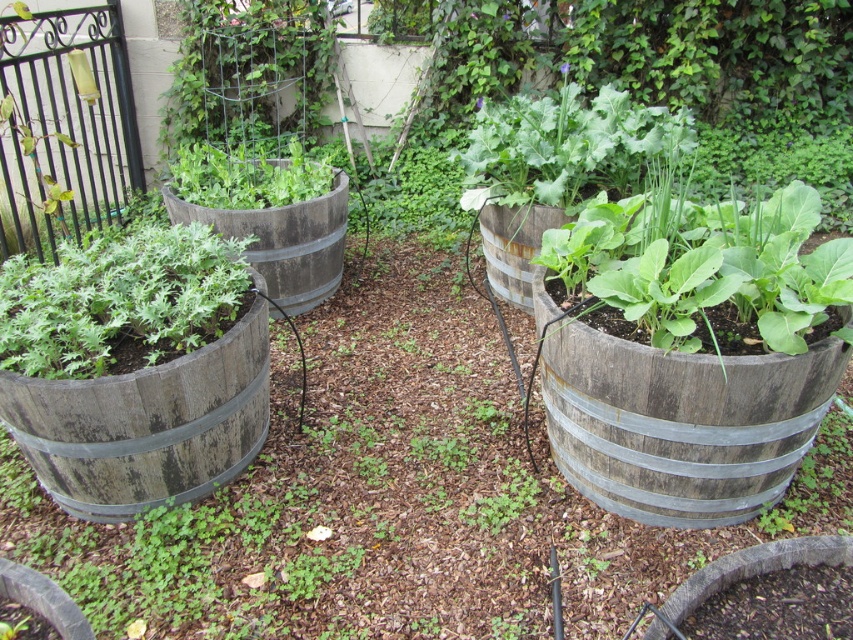
Can you confirm if gray wood barrel at center is wider than rusty wood barrel at center-right?

Yes.

Find the location of a particular element. This screenshot has width=853, height=640. gray wood barrel at center is located at coordinates (283, 241).

Locate an element on the screen. The width and height of the screenshot is (853, 640). gray wood barrel at center is located at coordinates (283, 241).

Is weathered wood barrel at center below gray wood barrel at center?

Indeed, weathered wood barrel at center is positioned under gray wood barrel at center.

Who is lower down, weathered wood barrel at center or gray wood barrel at center?

weathered wood barrel at center

This screenshot has width=853, height=640. Identify the location of weathered wood barrel at center. (682, 422).

You are a GUI agent. You are given a task and a screenshot of the screen. Output one action in this format:
    pyautogui.click(x=<x>, y=<y>)
    Task: Click on the weathered wood barrel at center
    The image size is (853, 640).
    Given the screenshot: What is the action you would take?
    pyautogui.click(x=682, y=422)

In the scene shown: Who is positioned more to the left, wooden barrel at left or green matte barrel at left?

green matte barrel at left

Can you confirm if wooden barrel at left is positioned to the left of green matte barrel at left?

Incorrect, wooden barrel at left is not on the left side of green matte barrel at left.

Which is in front, point (175, 448) or point (111, 282)?

Positioned in front is point (175, 448).

Where is `wooden barrel at left`? This screenshot has width=853, height=640. wooden barrel at left is located at coordinates (146, 424).